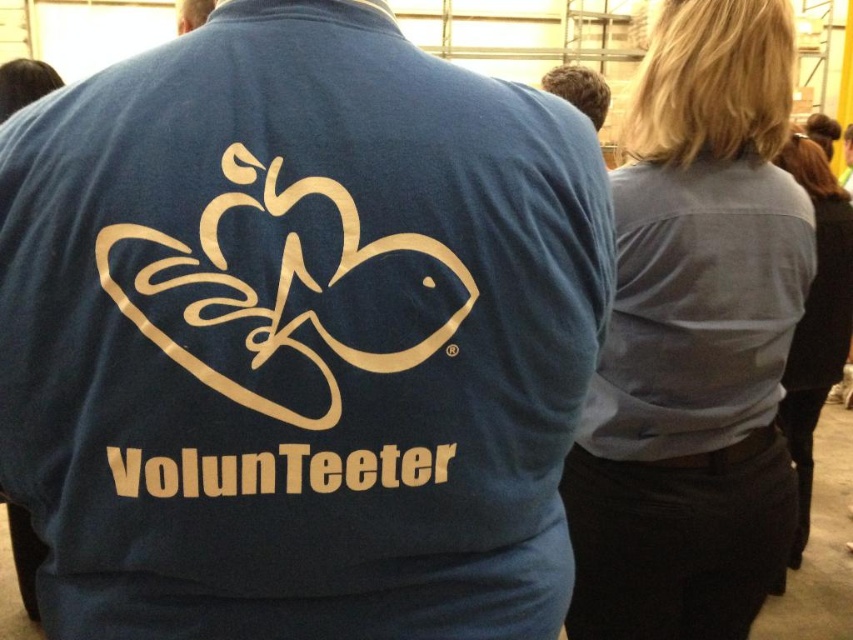
You are a photographer standing 10 feet away from the matte blue shirt at center. If you want to take a closeup photo of the shirt, would you need to move closer or farther away?

The matte blue shirt at center is 23.76 inches away from the viewer. Since you are currently 10 feet away, which is approximately 120 inches, you need to move closer to get a closeup photo.